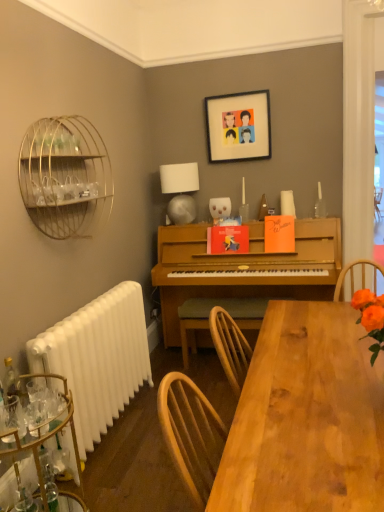
Measure the distance between point (188, 303) and camera.

Point (188, 303) is 3.43 meters away from camera.

Identify the location of white plastic radiator at lower left. This screenshot has height=512, width=384. pos(98,358).

Describe the element at coordinates (180, 191) in the screenshot. I see `white glossy lampshade at upper center` at that location.

The height and width of the screenshot is (512, 384). I want to click on metallic gold bar cart at lower left, so click(x=40, y=450).

In order to face matte plastic picture frame at upper center, should I rotate leftwards or rightwards?

To face it directly, rotate right by 6.408 degrees.

This screenshot has width=384, height=512. What are the coordinates of `wooden chair at center` in the screenshot? It's located at (209, 314).

This screenshot has width=384, height=512. I want to click on picture frame lying above the wooden chair at center (from the image's perspective), so click(x=238, y=126).

Is there a large distance between matte plastic picture frame at upper center and wooden chair at center?

Yes.

Which is behind, matte plastic picture frame at upper center or wooden chair at center?

Positioned behind is matte plastic picture frame at upper center.

Is white plastic radiator at lower left located outside matte plastic picture frame at upper center?

Indeed, white plastic radiator at lower left is completely outside matte plastic picture frame at upper center.

Can you confirm if white plastic radiator at lower left is taller than matte plastic picture frame at upper center?

Yes.

Would you say white plastic radiator at lower left is a long distance from matte plastic picture frame at upper center?

Yes, white plastic radiator at lower left is far from matte plastic picture frame at upper center.

Which object is thinner, white plastic radiator at lower left or matte plastic picture frame at upper center?

Thinner between the two is matte plastic picture frame at upper center.

Is point (212, 501) closer to viewer compared to point (5, 410)?

Yes, it is.

Does wooden table at lower center have a greater width compared to metallic gold bar cart at lower left?

Correct, the width of wooden table at lower center exceeds that of metallic gold bar cart at lower left.

Is wooden table at lower center to the left of metallic gold bar cart at lower left from the viewer's perspective?

In fact, wooden table at lower center is to the right of metallic gold bar cart at lower left.

From the image's perspective, is wooden table at lower center under metallic gold bar cart at lower left?

No.

From a real-world perspective, who is located higher, metallic gold bar cart at lower left or white glossy lampshade at upper center?

white glossy lampshade at upper center is physically above.

Considering the sizes of objects metallic gold bar cart at lower left and white glossy lampshade at upper center in the image provided, who is wider, metallic gold bar cart at lower left or white glossy lampshade at upper center?

With larger width is metallic gold bar cart at lower left.

Between metallic gold bar cart at lower left and white glossy lampshade at upper center, which one appears on the right side from the viewer's perspective?

white glossy lampshade at upper center is more to the right.

Locate an element on the screen. The image size is (384, 512). picture frame above the metallic gold bar cart at lower left (from the image's perspective) is located at coordinates (238, 126).

Can matte plastic picture frame at upper center be found inside metallic gold bar cart at lower left?

No, metallic gold bar cart at lower left does not contain matte plastic picture frame at upper center.

Is point (63, 380) in front of point (234, 148)?

Yes.

In the scene shown: From the image's perspective, is white glossy lampshade at upper center over white plastic radiator at lower left?

Yes, from the image's perspective, white glossy lampshade at upper center is on top of white plastic radiator at lower left.

Are white glossy lampshade at upper center and white plastic radiator at lower left located far from each other?

Yes, white glossy lampshade at upper center is far from white plastic radiator at lower left.

Identify the location of lamp on the right of white plastic radiator at lower left. coord(180,191).

Is gold wire birdcage at left closer to camera compared to wooden chair at center?

Yes, it is in front of wooden chair at center.

Does point (24, 170) appear closer or farther from the camera than point (236, 313)?

Clearly, point (24, 170) is closer to the camera than point (236, 313).

Which object is positioned more to the left, gold wire birdcage at left or wooden chair at center?

Positioned to the left is gold wire birdcage at left.

Find the location of a particular element. The height and width of the screenshot is (512, 384). chair located on the left of matte plastic picture frame at upper center is located at coordinates (209, 314).

Identify the location of picture frame that is above the white plastic radiator at lower left (from a real-world perspective). (238, 126).

When comparing their distances from wooden chair at center, does white plastic radiator at lower left or gold wire birdcage at left seem further?

Based on the image, gold wire birdcage at left appears to be further to wooden chair at center.

Based on their spatial positions, is white glossy lampshade at upper center or metallic gold bar cart at lower left further from matte plastic picture frame at upper center?

metallic gold bar cart at lower left lies further to matte plastic picture frame at upper center than the other object.

When comparing their distances from gold wire birdcage at left, does wooden chair at center or matte plastic picture frame at upper center seem further?

Based on the image, matte plastic picture frame at upper center appears to be further to gold wire birdcage at left.

Estimate the real-world distances between objects in this image. Which object is further from matte plastic picture frame at upper center, white glossy lampshade at upper center or gold wire birdcage at left?

The object further to matte plastic picture frame at upper center is gold wire birdcage at left.

Which object lies further to the anchor point wooden chair at center, gold wire birdcage at left or metallic gold bar cart at lower left?

metallic gold bar cart at lower left.

Looking at the image, which one is located further to wooden chair at center, matte plastic picture frame at upper center or white glossy lampshade at upper center?

matte plastic picture frame at upper center is further to wooden chair at center.

Estimate the real-world distances between objects in this image. Which object is closer to white glossy lampshade at upper center, white plastic radiator at lower left or metallic gold bar cart at lower left?

white plastic radiator at lower left lies closer to white glossy lampshade at upper center than the other object.

When comparing their distances from matte plastic picture frame at upper center, does wooden chair at center or metallic gold bar cart at lower left seem closer?

wooden chair at center lies closer to matte plastic picture frame at upper center than the other object.

Image resolution: width=384 pixels, height=512 pixels. What are the coordinates of `picture frame between gold wire birdcage at left and white glossy lampshade at upper center in the front-back direction` in the screenshot? It's located at click(238, 126).

In order to click on radiator between gold wire birdcage at left and wooden chair at center from front to back in this screenshot , I will do `click(98, 358)`.

The width and height of the screenshot is (384, 512). I want to click on radiator between gold wire birdcage at left and metallic gold bar cart at lower left from top to bottom, so click(x=98, y=358).

I want to click on lamp between matte plastic picture frame at upper center and wooden chair at center vertically, so click(x=180, y=191).